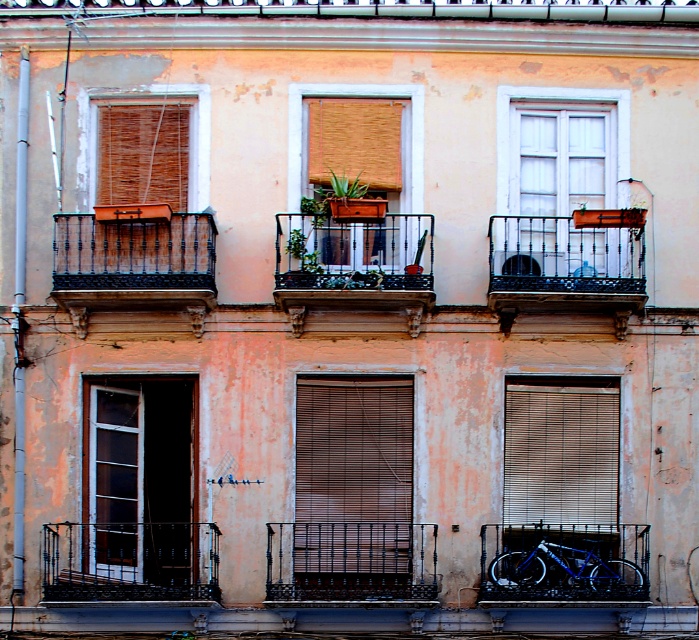
Question: Which of the following is the closest to the observer?

Choices:
 (A) wooden blinds at center
 (B) blue metallic bicycle at lower right
 (C) black wrought iron balcony at lower left
 (D) wooden/textured planter at center

Answer: (C)

Question: Which object is positioned farthest from the rustic wrought iron balcony at center?

Choices:
 (A) matte glass door at left
 (B) wooden blinds at center
 (C) blue metallic bicycle at lower right

Answer: (A)

Question: Does brown wooden blinds at center appear over matte glass door at left?

Choices:
 (A) no
 (B) yes

Answer: (A)

Question: In this image, where is wooden/textured planter at center located relative to wooden blinds at center?

Choices:
 (A) above
 (B) below

Answer: (B)

Question: Can you confirm if wooden blinds at lower right is bigger than black wrought iron balcony at lower left?

Choices:
 (A) yes
 (B) no

Answer: (B)

Question: Among these objects, which one is farthest from the camera?

Choices:
 (A) brown wooden blinds at center
 (B) wooden blinds at center

Answer: (B)